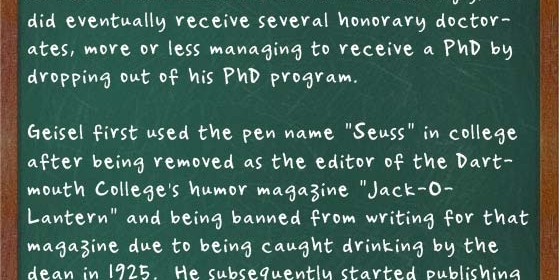
The height and width of the screenshot is (280, 559). What are the coordinates of `green chalkboard` in the screenshot? It's located at (66, 107), (239, 110), (325, 112).